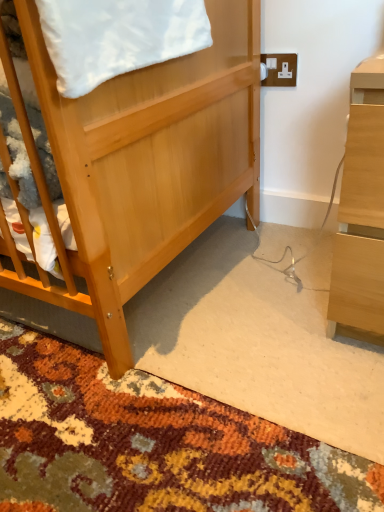
The image size is (384, 512). I want to click on free spot above carpeted rug at center (from a real-world perspective), so click(183, 336).